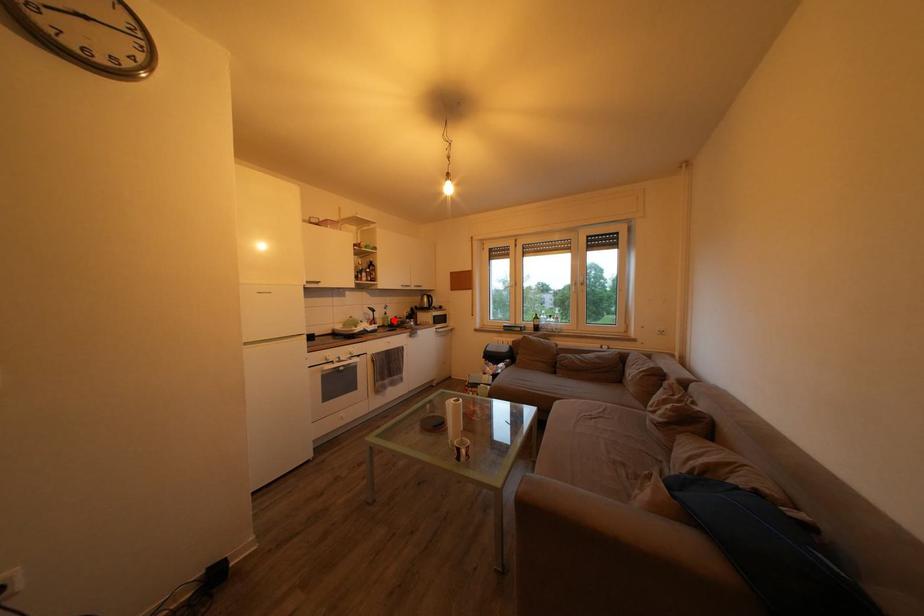
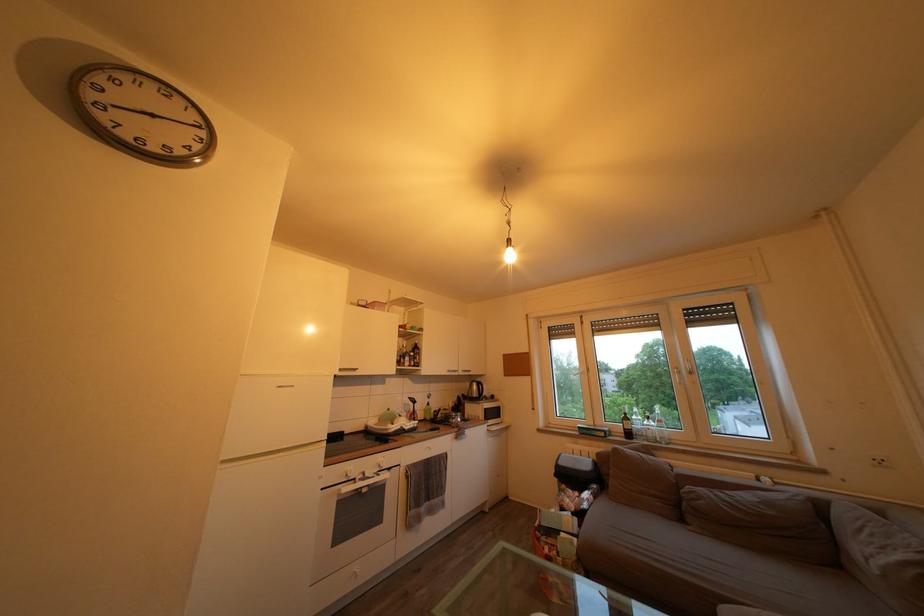
Find the pixel in the second image that matches the highlighted location in the first image.

(436, 411)